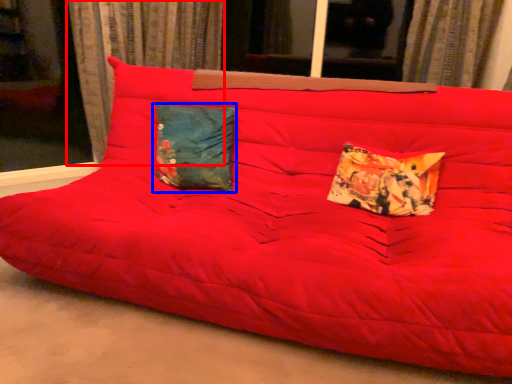
Question: Which object is closer to the camera taking this photo, curtain (highlighted by a red box) or pillow (highlighted by a blue box)?

Choices:
 (A) curtain
 (B) pillow

Answer: (B)